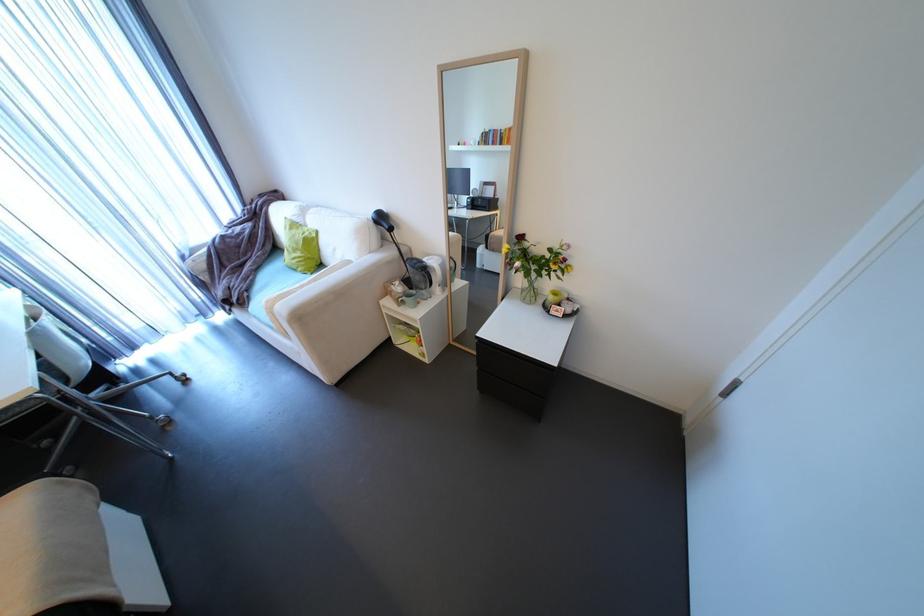
Describe the element at coordinates (536, 265) in the screenshot. The image size is (924, 616). I see `the glass vase` at that location.